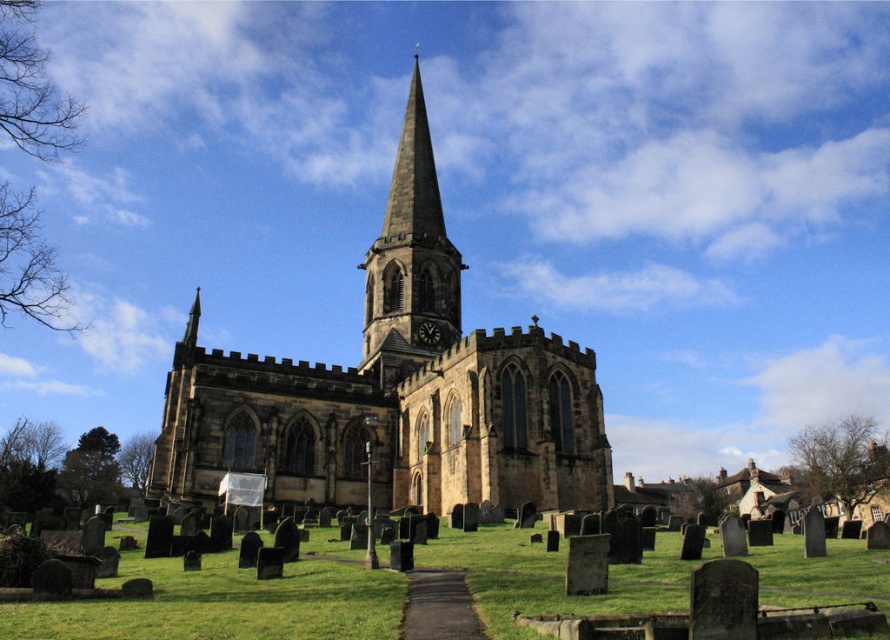
Is brown stone church at center positioned in front of smooth stone spire at center?

Yes, it is.

Is point (263, 362) positioned after point (422, 112)?

No, (263, 362) is in front of (422, 112).

This screenshot has height=640, width=890. Describe the element at coordinates (395, 390) in the screenshot. I see `brown stone church at center` at that location.

Locate an element on the screen. This screenshot has width=890, height=640. brown stone church at center is located at coordinates [x=395, y=390].

Can you confirm if green grass at lower center is bigger than smooth stone spire at center?

Actually, green grass at lower center might be smaller than smooth stone spire at center.

Which is more to the left, green grass at lower center or smooth stone spire at center?

Positioned to the left is smooth stone spire at center.

Does point (222, 628) come behind point (392, 177)?

No, (222, 628) is closer to viewer.

The width and height of the screenshot is (890, 640). Identify the location of green grass at lower center. (228, 602).

Is brown stone church at center bigger than green grass at lower center?

Correct, brown stone church at center is larger in size than green grass at lower center.

Can you confirm if brown stone church at center is smaller than green grass at lower center?

No.

Image resolution: width=890 pixels, height=640 pixels. What are the coordinates of `brown stone church at center` in the screenshot? It's located at (395, 390).